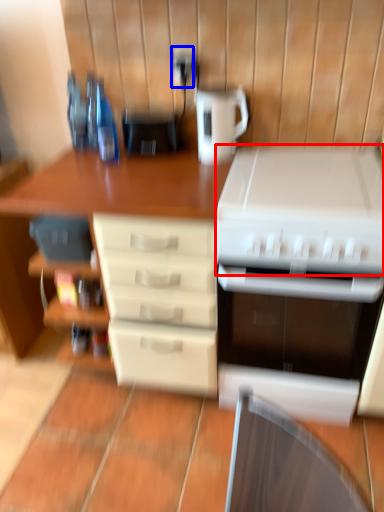
Question: Among these objects, which one is nearest to the camera, appliance (highlighted by a red box) or electric outlet (highlighted by a blue box)?

Choices:
 (A) appliance
 (B) electric outlet

Answer: (A)